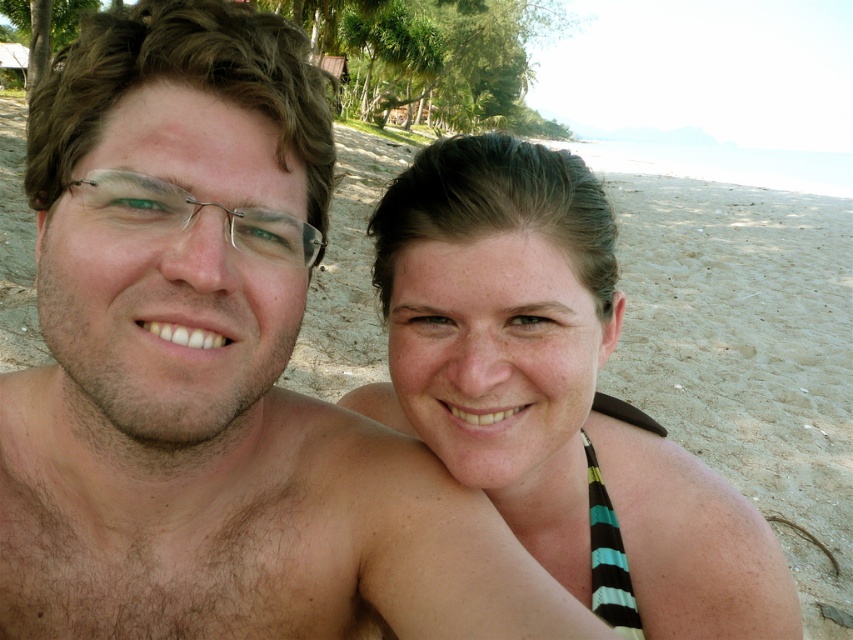
Is matte black bikini top at center taller than metallic wire frame glasses at left?

Yes, matte black bikini top at center is taller than metallic wire frame glasses at left.

Can you confirm if matte black bikini top at center is bigger than metallic wire frame glasses at left?

Yes.

Describe the element at coordinates (554, 394) in the screenshot. This screenshot has height=640, width=853. I see `matte black bikini top at center` at that location.

Image resolution: width=853 pixels, height=640 pixels. Find the location of `matte black bikini top at center`. matte black bikini top at center is located at coordinates click(x=554, y=394).